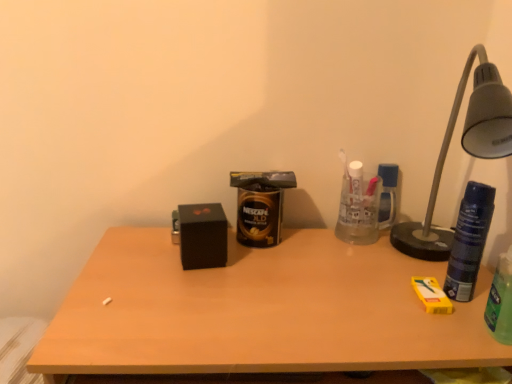
At what (x,y) coordinates should I click in order to perform the action: click on vacant space in between metallic gray lamp at right and gold metallic can at center, the 1th beverage positioned from the back. Please return your answer as a coordinate pair (x, y). The width and height of the screenshot is (512, 384). Looking at the image, I should click on (341, 268).